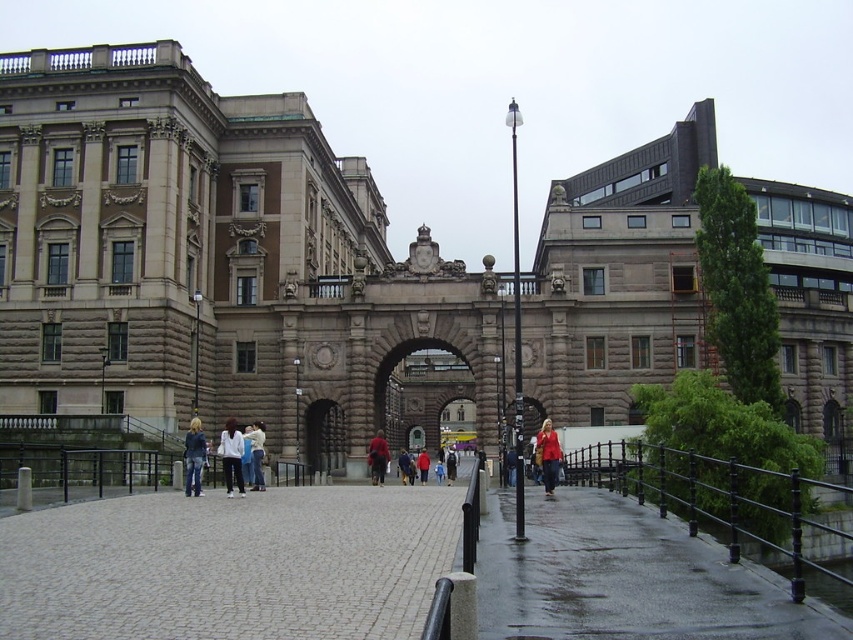
You are a tourist visiting this historic building and want to take a photo of the gray cobblestone pavement at center and the red fabric coat at center. Which object should you focus on if you want to capture the larger one in your photo?

The gray cobblestone pavement at center is larger in size than the red fabric coat at center, so you should focus on the gray cobblestone pavement at center to capture the larger one in your photo.

You are standing in front of the historic building and see the gray cobblestone pavement at center and the matte red coat at center. Which object is positioned to the left of the other?

The gray cobblestone pavement at center is to the left of the matte red coat at center according to the description.